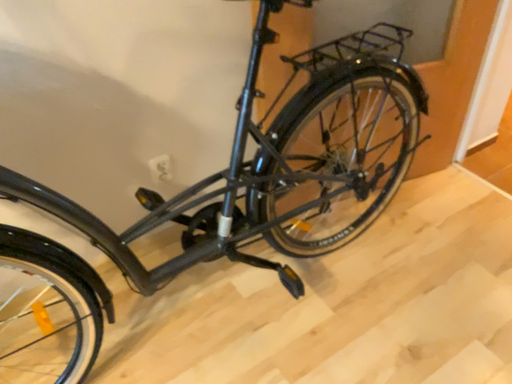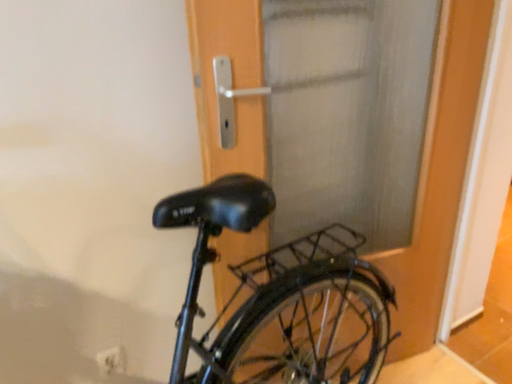
Question: How did the camera likely rotate when shooting the video?

Choices:
 (A) rotated downward
 (B) rotated upward

Answer: (B)